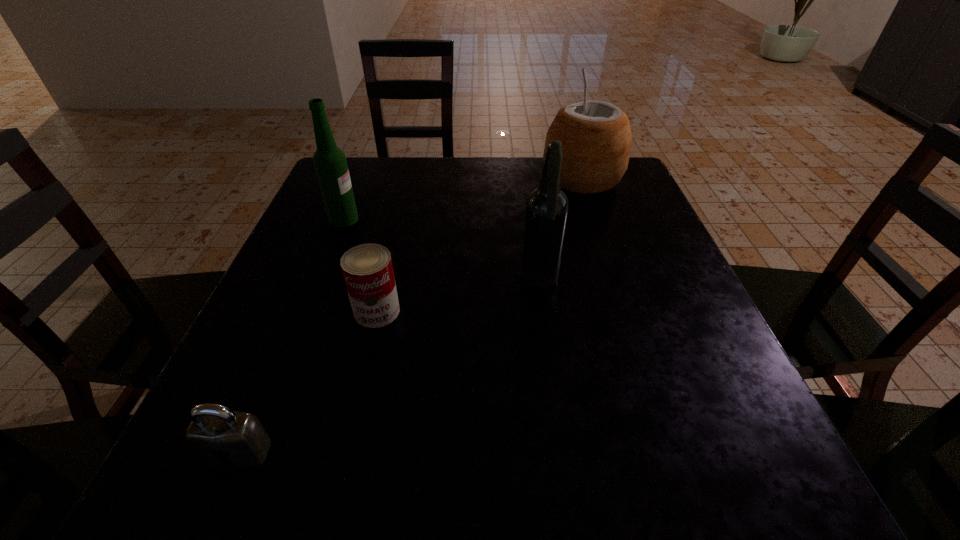
At what (x,y) coordinates should I click in order to perform the action: click on free space at the near edge of the desktop. Please return your answer as a coordinate pair (x, y). The width and height of the screenshot is (960, 540). Looking at the image, I should click on (526, 465).

The width and height of the screenshot is (960, 540). In the image, there is a desktop. What are the coordinates of `vacant space at the left edge` in the screenshot? It's located at (252, 406).

Find the location of a particular element. This screenshot has width=960, height=540. vacant area at the right edge of the desktop is located at coordinates (614, 294).

The image size is (960, 540). In the image, there is a desktop. Find the location of `vacant space at the far left corner`. vacant space at the far left corner is located at coordinates tap(357, 201).

Locate an element on the screen. This screenshot has height=540, width=960. vacant area at the near right corner is located at coordinates (777, 469).

This screenshot has width=960, height=540. I want to click on free spot between the left beer bottle and the right beer bottle, so click(443, 251).

Image resolution: width=960 pixels, height=540 pixels. What are the coordinates of `vacant space that is in between the nearer beer bottle and the padlock` in the screenshot? It's located at (390, 367).

Find the location of `vacant region between the can and the fourth object from left to right`. vacant region between the can and the fourth object from left to right is located at coordinates (459, 296).

Find the location of a particular element. This screenshot has width=960, height=540. vacant space in between the right beer bottle and the third object from left to right is located at coordinates (459, 296).

Where is `vacant area that lies between the can and the nearest object`? vacant area that lies between the can and the nearest object is located at coordinates (308, 382).